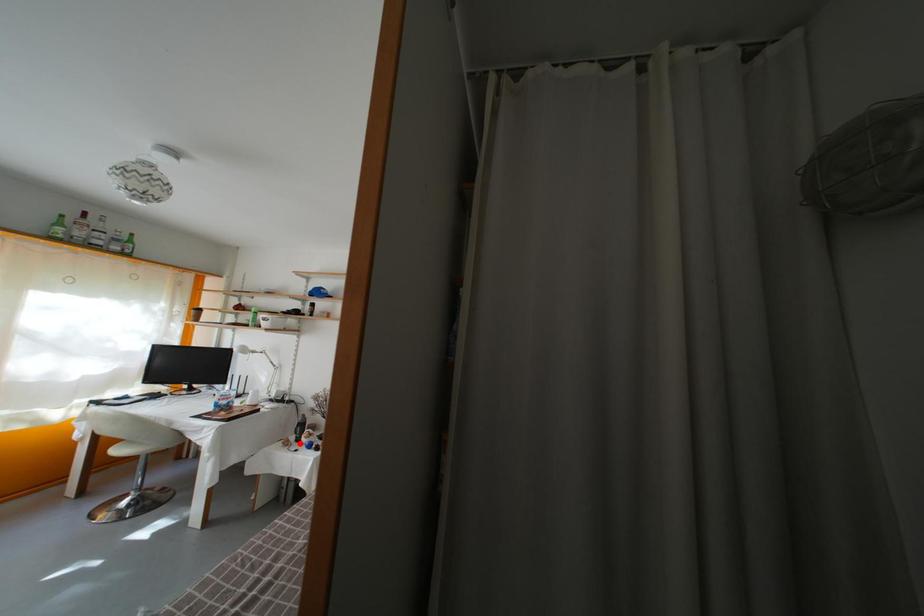
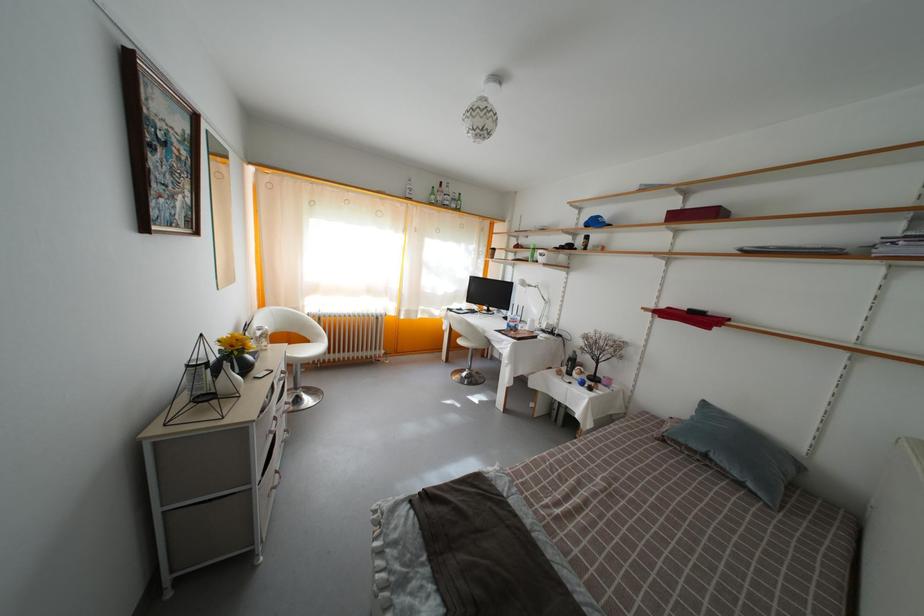
Locate, in the second image, the point that corresponds to the highlighted location in the first image.

(569, 376)